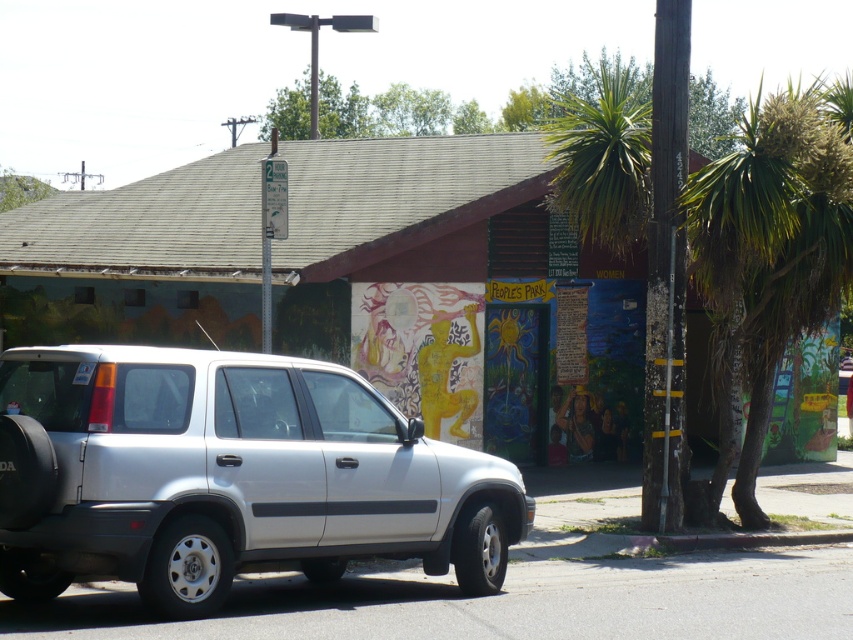
You are a delivery driver who needs to park your vehicle in a tight space between the silver metallic suv at center and the wooden pole at right. Given that your delivery van is 2 meters wide, can you safely fit your van between them?

The silver metallic suv at center is wider than the wooden pole at right. However, the exact distance between them isn not provided. Without knowing the space between the two objects, it is impossible to determine if the 2 meter wide van can fit safely.

You are a delivery person who needs to park your 15.5 feet long truck between the silver metallic suv at center and the wooden pole at right. Based on the scene, can your truck fit in the space between them?

The distance between the silver metallic suv at center and the wooden pole at right is 18.25 feet. Since your truck is 15.5 feet long, it can fit in the space between them as there is enough room.

You are a delivery person trying to park your 2.5 meter tall van. You see the silver metallic suv at center and the wooden pole at right. Which object is shorter and can you safely park your van between them without hitting the taller one?

The silver metallic suv at center is shorter than the wooden pole at right. Since your van is 2.5 meters tall and the suv is shorter than the pole, you can safely park between them as long as you avoid the taller wooden pole at right.